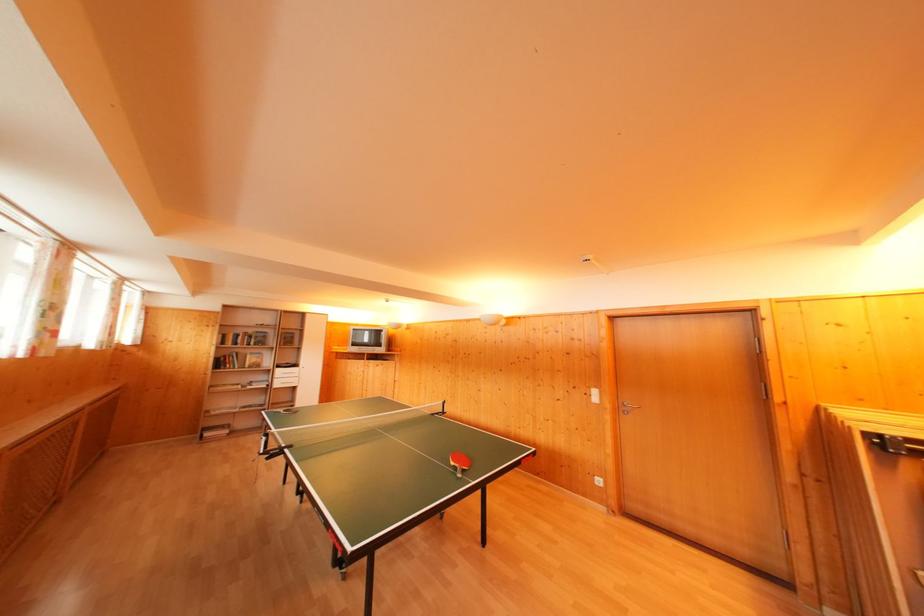
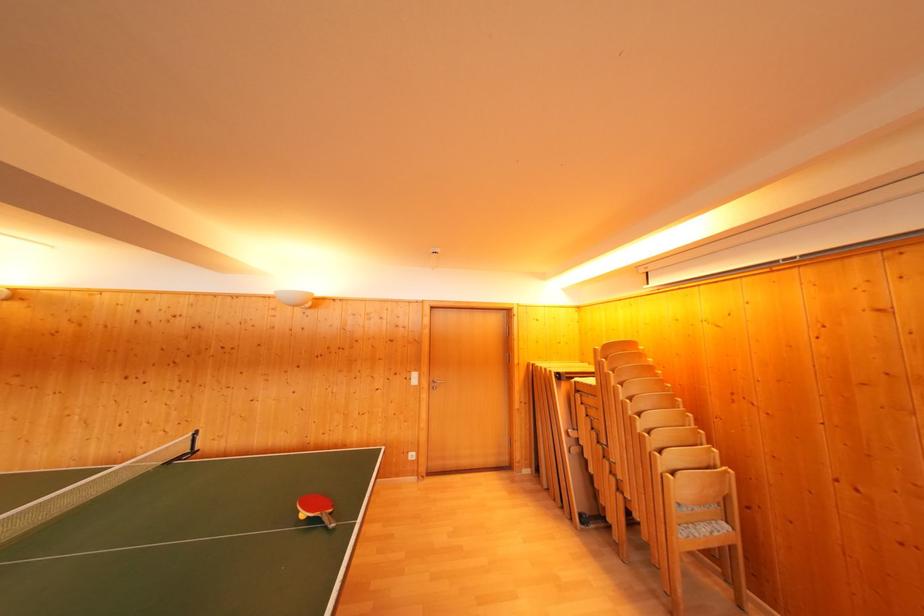
Question: How did the camera likely rotate?

Choices:
 (A) Left
 (B) Right
 (C) Up
 (D) Down

Answer: (B)